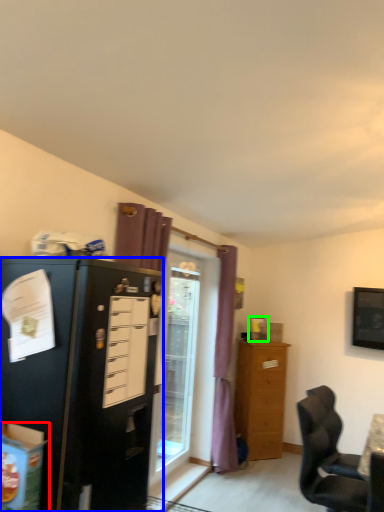
Question: Which object is the closest to the box (highlighted by a red box)? Choose among these: cabinetry (highlighted by a blue box) or picture frame (highlighted by a green box).

Choices:
 (A) cabinetry
 (B) picture frame

Answer: (A)